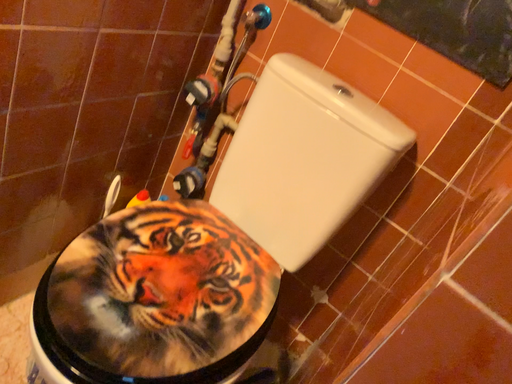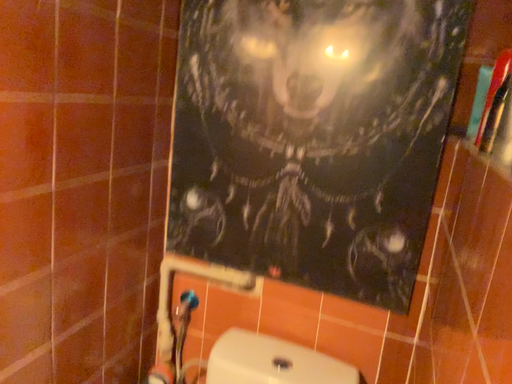
Question: How did the camera likely rotate when shooting the video?

Choices:
 (A) rotated upward
 (B) rotated downward

Answer: (A)